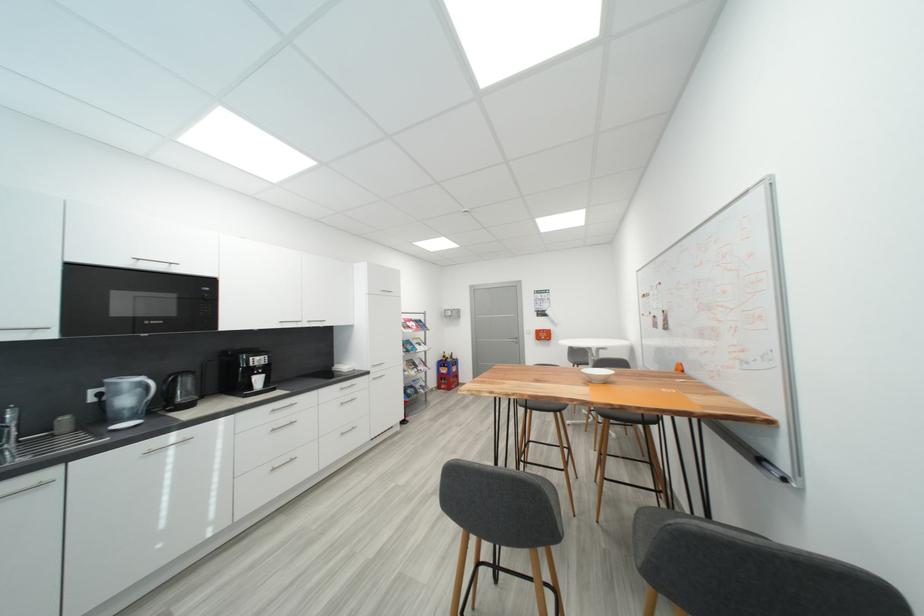
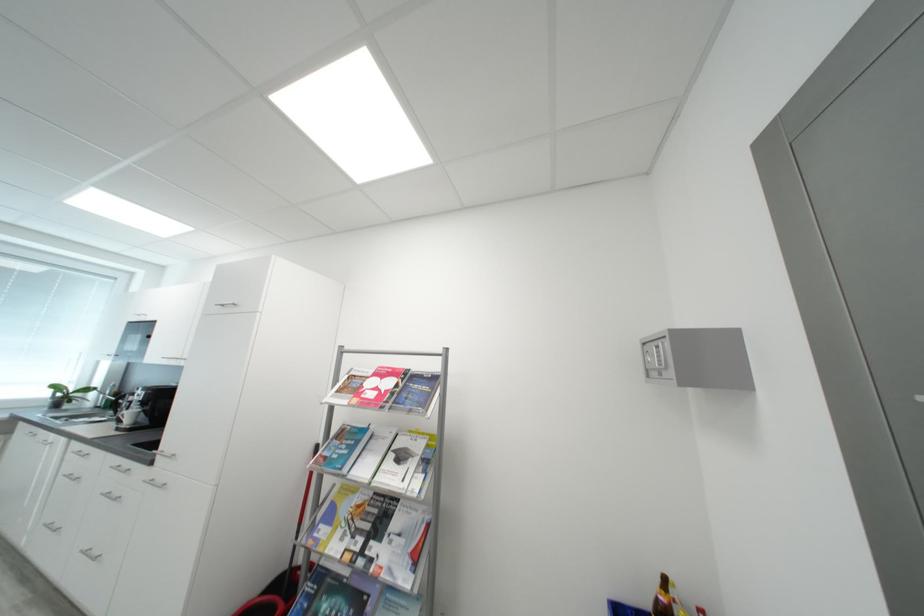
In the second image, find the point that corresponds to point 456,315 in the first image.

(660, 361)